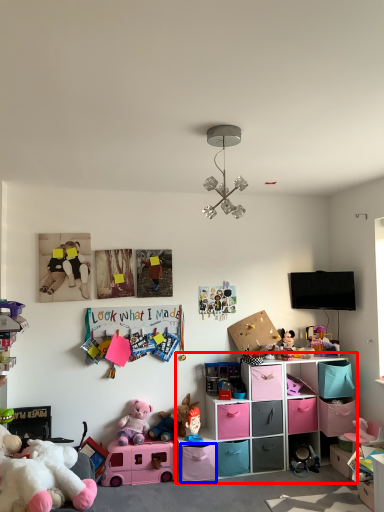
Question: Which of the following is the closest to the observer, shelf (highlighted by a red box) or storage box (highlighted by a blue box)?

Choices:
 (A) shelf
 (B) storage box

Answer: (B)